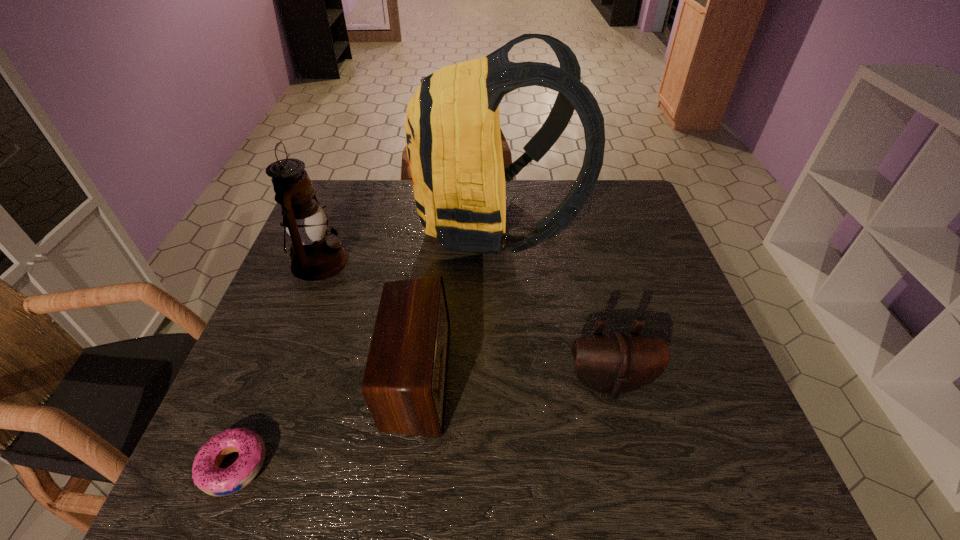
This screenshot has height=540, width=960. I want to click on the tallest object, so click(x=452, y=128).

Find the location of `the second tallest object`. the second tallest object is located at coordinates (315, 255).

Find the location of `radio receiver`. radio receiver is located at coordinates point(404,385).

Find the location of a particular element. This screenshot has height=540, width=960. pouch is located at coordinates (613, 363).

Locate an element on the screen. The height and width of the screenshot is (540, 960). doughnut is located at coordinates (207, 475).

The image size is (960, 540). Identify the location of vacant space situated 0.230m on the front-facing side of the tallest object. [339, 223].

The width and height of the screenshot is (960, 540). Identify the location of vacant space located 0.320m on the front-facing side of the tallest object. (308, 223).

Where is `vacant region located 0.210m on the front-facing side of the tallest object`? vacant region located 0.210m on the front-facing side of the tallest object is located at coordinates tap(346, 223).

Where is `vacant space located on the side of the fourth shortest object, there is a wick adjustment knob`? This screenshot has width=960, height=540. vacant space located on the side of the fourth shortest object, there is a wick adjustment knob is located at coordinates (370, 261).

Identify the location of free point located on the front-facing side of the radio receiver. Image resolution: width=960 pixels, height=540 pixels. (475, 376).